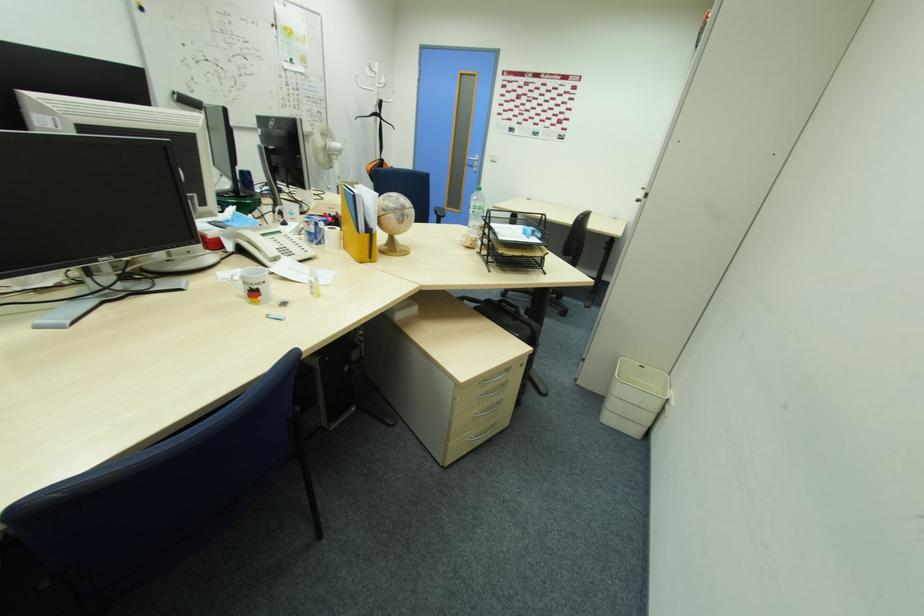
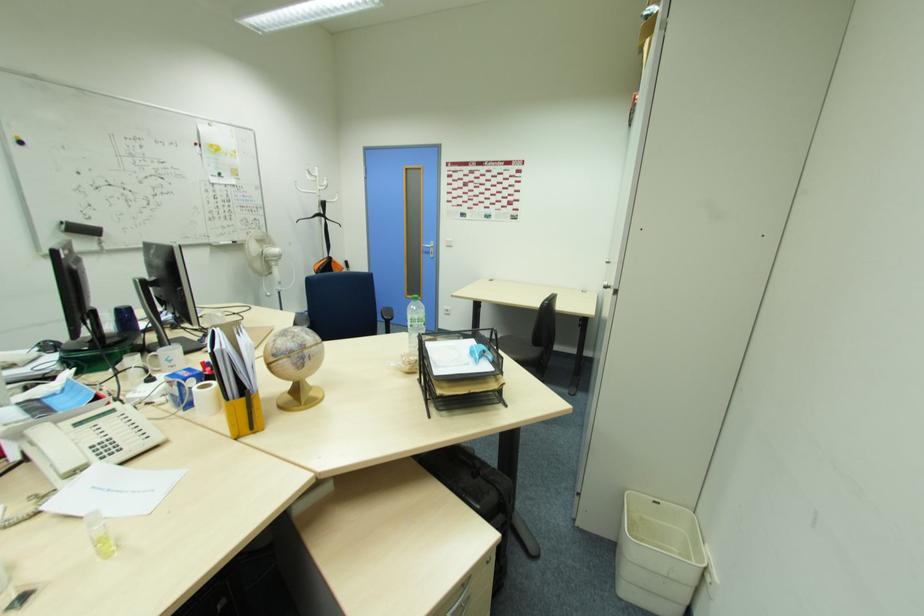
Where in the second image is the point corresponding to point 475,164 from the first image?

(430, 252)